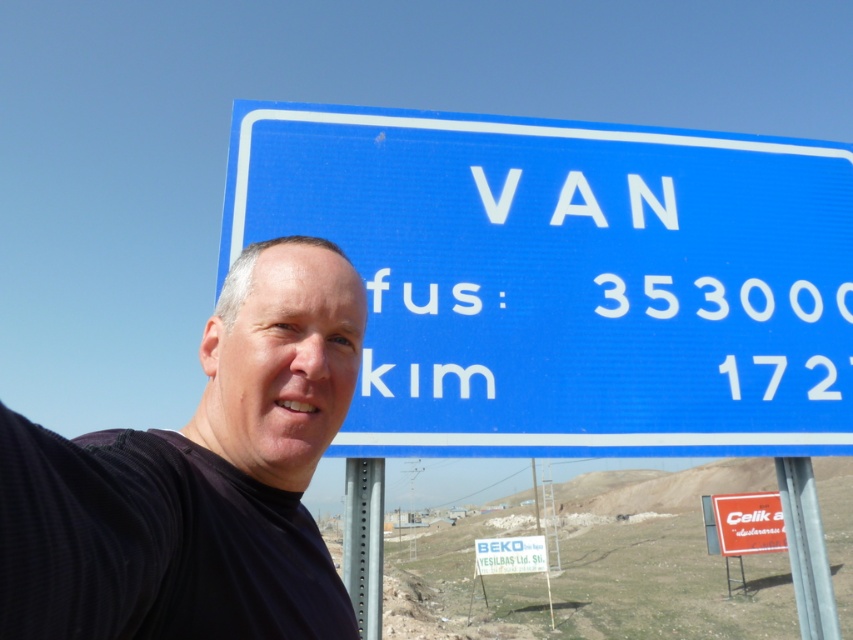
You are a photographer trying to capture the metallic gray pole at right and the white plastic sign at lower right in a single frame. Based on their sizes, which object should you focus on first to ensure both are clearly visible in your photo?

The metallic gray pole at right has a smaller size compared to the white plastic sign at lower right. To ensure both are clearly visible, focus on the smaller metallic gray pole at right first, then adjust the camera to include the larger white plastic sign at lower right in the frame.

You are a tourist trying to take a photo of the white plastic sign at upper center and the metallic gray pole at right. Based on their positions, which object should you focus on first to ensure both are in the frame?

The metallic gray pole at right is located above the white plastic sign at upper center, so you should focus on the white plastic sign at upper center first to ensure both are in the frame.

You are a photographer trying to capture both the metallic pole at center and the white plastic sign at lower right in the same frame. Given that your camera has a maximum angle of view of 60 degrees, can you determine if both objects will fit in the frame without moving your camera? Please provide a concise answer.

The metallic pole at center and white plastic sign at lower right are 18.14 meters apart. To determine if they fit in a 60 degree angle, we can calculate the minimum distance required. Using trigonometry, the distance should be at least half the distance between the objects divided by tan of half the angle. So, 18.14 meters divided by 2 equals 9.07 meters. Then tan 30 degrees is approximately 0.577. Multiplying 9.07 by 0.577 gives about 5.24 meters. This means the photographer must be at least 5.24 meters.